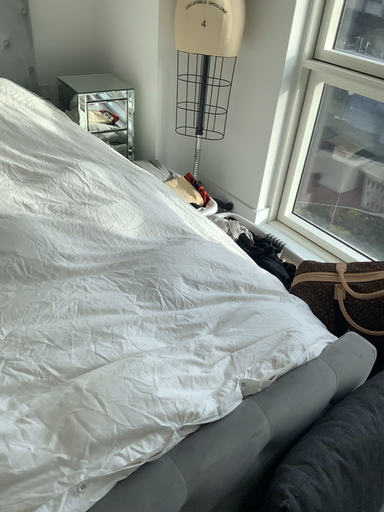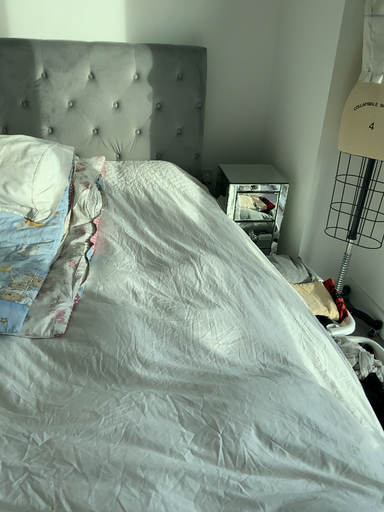
Question: Which way did the camera rotate in the video?

Choices:
 (A) rotated downward
 (B) rotated upward

Answer: (B)